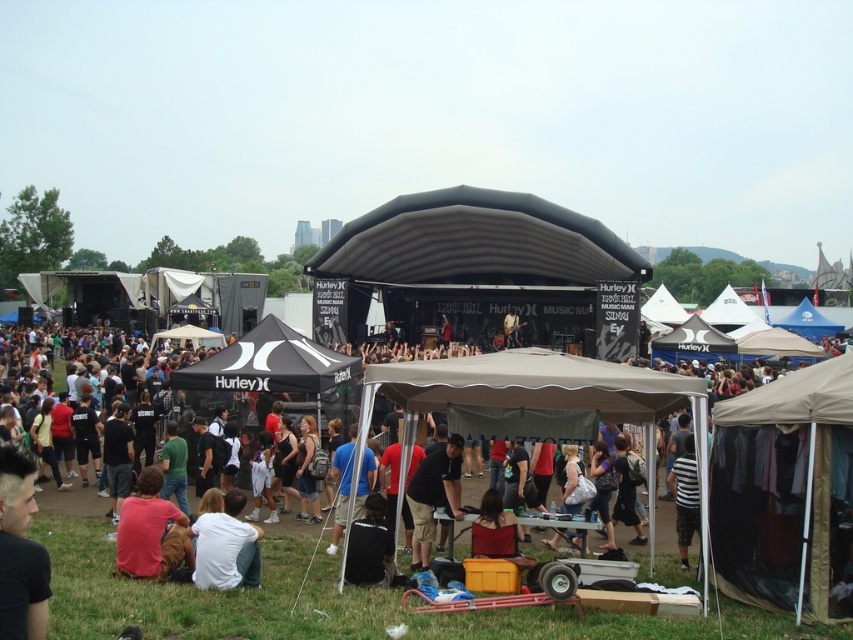
Question: Can you confirm if matte red shirt at lower left is positioned to the right of matte black jacket at lower center?

Choices:
 (A) yes
 (B) no

Answer: (B)

Question: Is matte red shirt at lower left to the left of matte black jacket at lower center from the viewer's perspective?

Choices:
 (A) yes
 (B) no

Answer: (A)

Question: Estimate the real-world distances between objects in this image. Which object is closer to the black matte canopy at center?

Choices:
 (A) matte black stage at center
 (B) blue fabric canopy at center
 (C) matte black jacket at lower center
 (D) black fabric canopy at center

Answer: (A)

Question: Is black matte canopy at center below blue fabric canopy at center?

Choices:
 (A) no
 (B) yes

Answer: (A)

Question: Among these objects, which one is nearest to the camera?

Choices:
 (A) white cotton shirt at lower center
 (B) blue fabric tent at center
 (C) blue fabric canopy at center
 (D) tan fabric tent at lower right

Answer: (D)

Question: Among these objects, which one is nearest to the camera?

Choices:
 (A) white cotton shirt at lower center
 (B) matte black stage at center
 (C) black matte canopy at center
 (D) matte black jacket at lower center

Answer: (B)